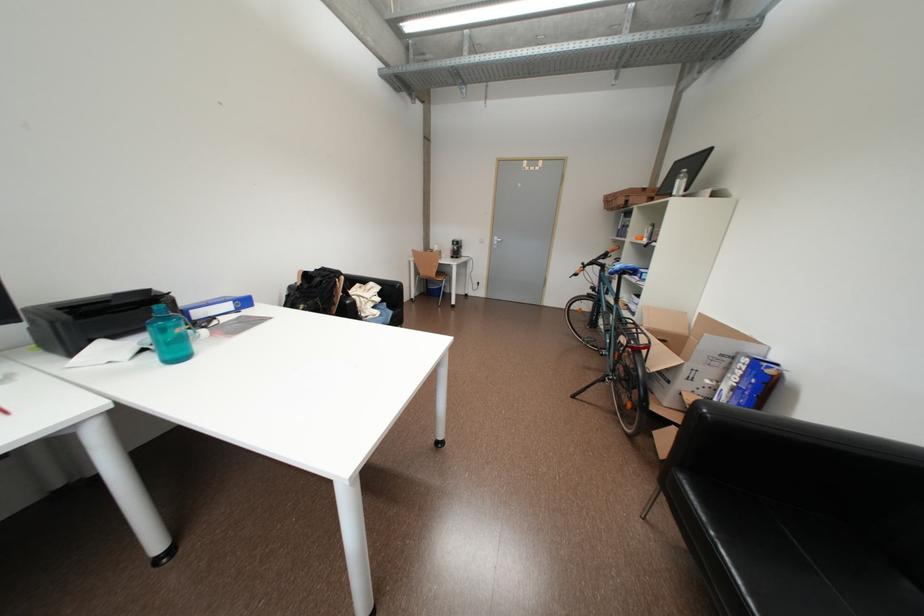
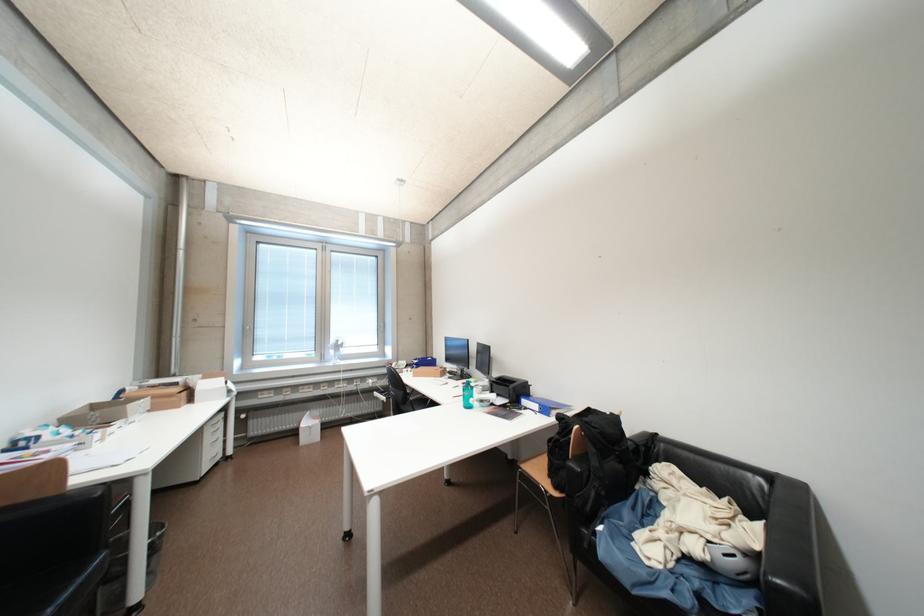
The point at (x=385, y=302) is marked in the first image. Where is the corresponding point in the second image?

(704, 551)